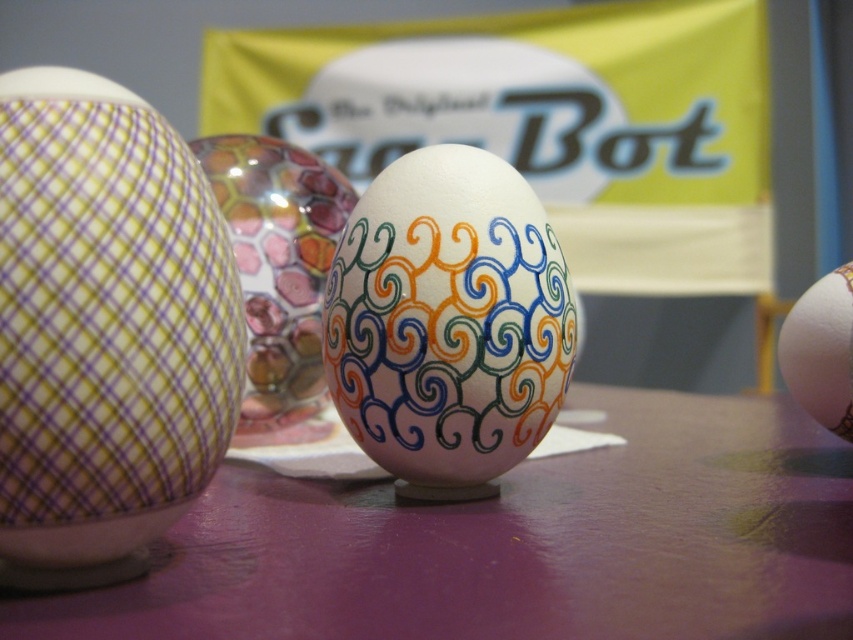
I want to click on matte purple checkered egg at left, so click(x=105, y=328).

Which is in front, point (224, 444) or point (508, 428)?

Point (224, 444)

I want to click on matte purple checkered egg at left, so click(x=105, y=328).

Does colorful painted egg at center have a larger size compared to matte white egg at right?

Correct, colorful painted egg at center is larger in size than matte white egg at right.

Is colorful painted egg at center further to camera compared to matte white egg at right?

Yes, it is behind matte white egg at right.

Describe the element at coordinates (447, 323) in the screenshot. The image size is (853, 640). I see `colorful painted egg at center` at that location.

Locate an element on the screen. This screenshot has width=853, height=640. colorful painted egg at center is located at coordinates (447, 323).

Based on the photo, can you confirm if purple matte table at center is positioned to the right of matte purple checkered egg at left?

Indeed, purple matte table at center is positioned on the right side of matte purple checkered egg at left.

How much distance is there between purple matte table at center and matte purple checkered egg at left?

The distance of purple matte table at center from matte purple checkered egg at left is 11.46 inches.

Is point (123, 609) behind point (32, 456)?

Yes, point (123, 609) is farther from viewer.

Image resolution: width=853 pixels, height=640 pixels. Identify the location of purple matte table at center. (515, 545).